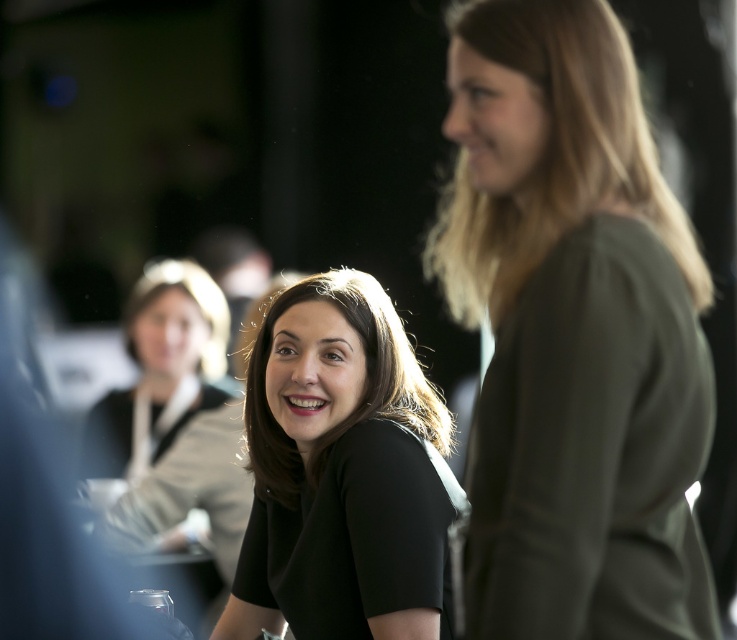
You are at a social event and want to approach the matte black shirt at center. There is an olive green jersey at right in your path. Can you walk between them without moving either object?

The olive green jersey at right is positioned on the right side of matte black shirt at center, so there is space between them. You can walk between the olive green jersey at right and the matte black shirt at center.

You are at a social event and want to approach the point marked as point (338,630). If you take three steps forward, each step covering 2.5 feet, will you reach the point?

The distance between you and point (338,630) is 7.18 feet. Taking three steps of 2.5 feet each would cover 7.5 feet, which exceeds the required distance. Therefore, you will reach the point.

You are attending a networking event and want to approach the two people in the image. The olive green jersey at right and the black matte shirt at center are part of the group. Since you want to greet them politely, which one should you approach first based on their positions?

The olive green jersey at right is located above the black matte shirt at center, so you should approach the black matte shirt at center first as they are lower and closer to your position.